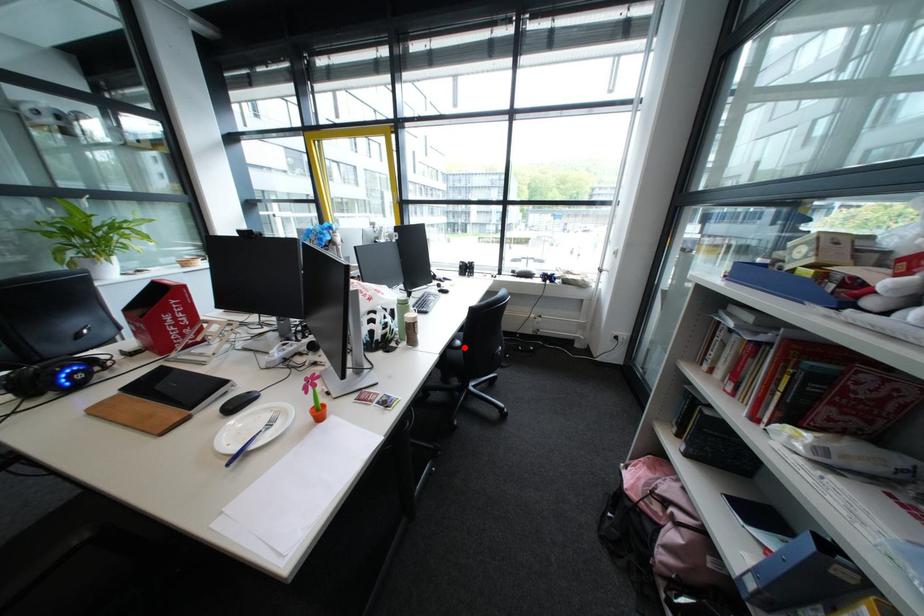
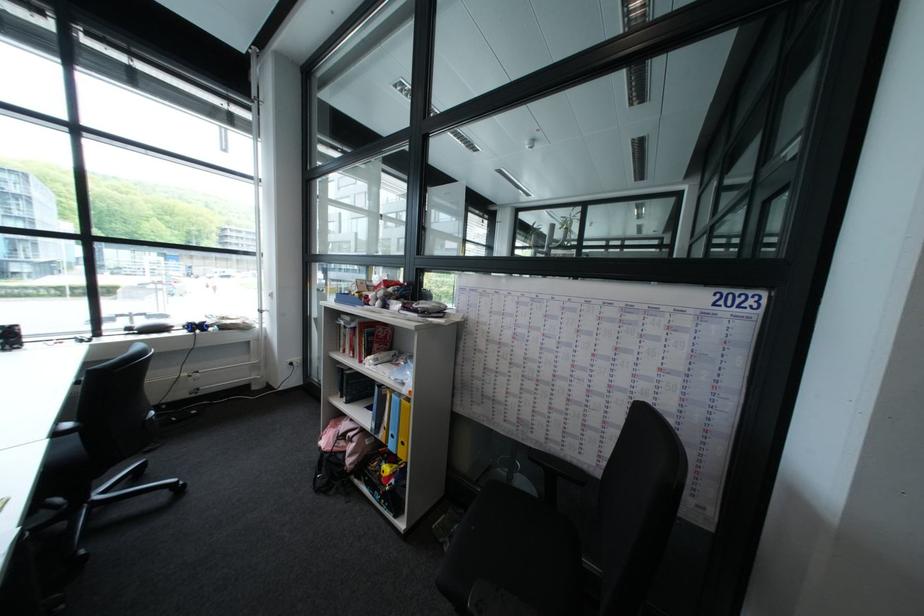
In the second image, find the point that corresponds to the highlighted location in the first image.

(70, 434)